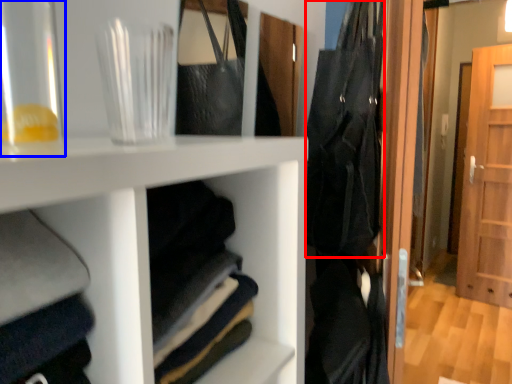
Question: Which object appears closest to the camera in this image, clothing (highlighted by a red box) or glass vase (highlighted by a blue box)?

Choices:
 (A) clothing
 (B) glass vase

Answer: (B)